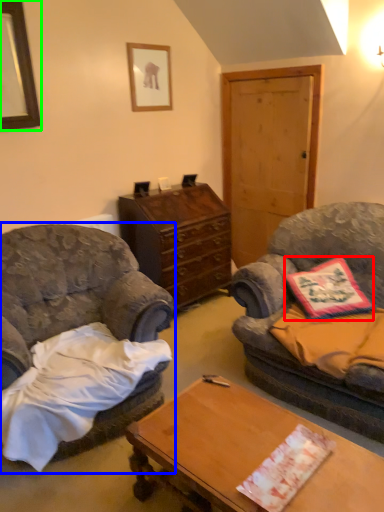
Question: Which object is positioned closest to pillow (highlighted by a red box)? Select from chair (highlighted by a blue box) and picture frame (highlighted by a green box).

Choices:
 (A) chair
 (B) picture frame

Answer: (A)